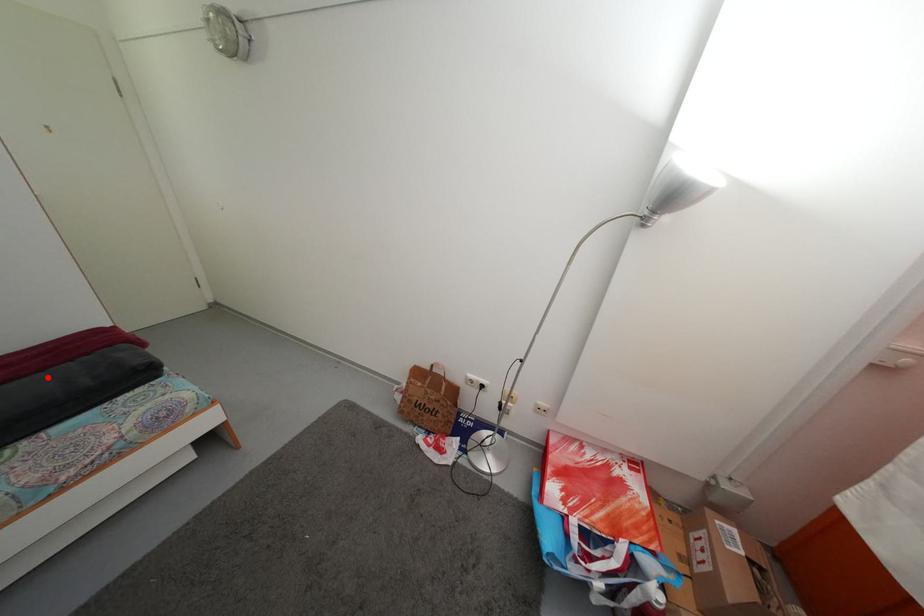
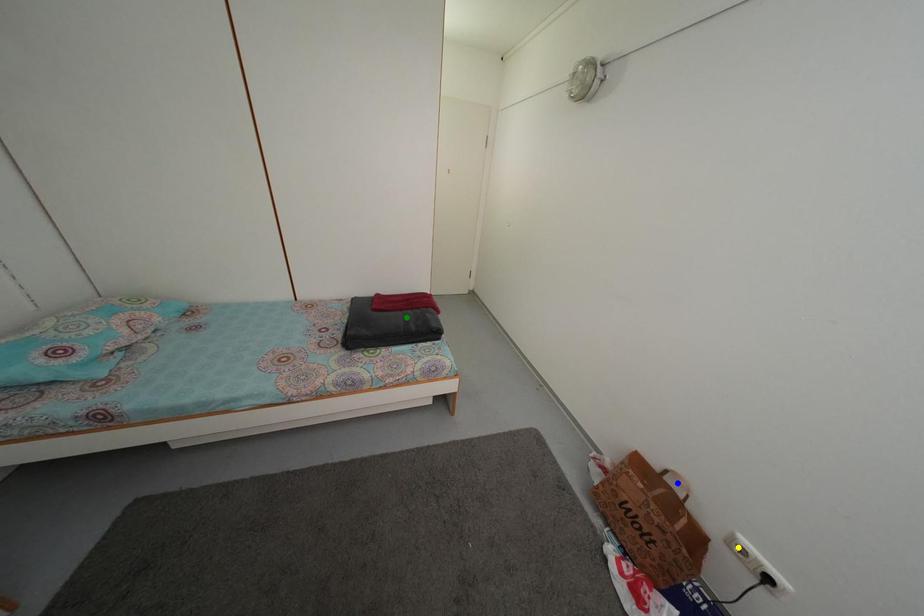
Question: I am providing you with two images of the same scene from different viewpoints. A red point is marked on the first image. You are given multiple points on the second image. Which point in image 2 represents the same 3d spot as the red point in image 1?

Choices:
 (A) green point
 (B) yellow point
 (C) blue point

Answer: (A)